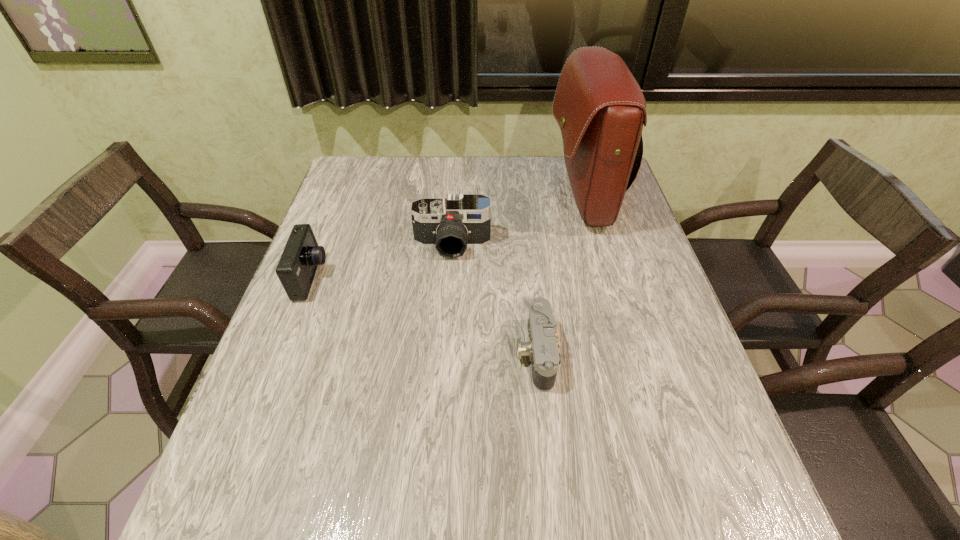
Where is `free space located on the front-facing side of the leftmost object`? free space located on the front-facing side of the leftmost object is located at coordinates (371, 278).

This screenshot has height=540, width=960. Identify the location of free space located on the lens of the nearest object. (465, 353).

I want to click on vacant space located on the lens of the nearest object, so (x=370, y=353).

Image resolution: width=960 pixels, height=540 pixels. I want to click on vacant space located 0.080m on the lens of the nearest object, so click(479, 353).

What are the coordinates of `object located in the far edge section of the desktop` in the screenshot? It's located at (599, 106).

The width and height of the screenshot is (960, 540). I want to click on object that is at the left edge, so point(296,269).

Locate an element on the screen. The height and width of the screenshot is (540, 960). object present at the right edge is located at coordinates (599, 106).

Image resolution: width=960 pixels, height=540 pixels. In order to click on object at the far right corner in this screenshot , I will do `click(599, 106)`.

Where is `free spot at the far edge of the desktop`? free spot at the far edge of the desktop is located at coordinates (492, 178).

In the image, there is a desktop. Identify the location of vacant space at the near edge. This screenshot has width=960, height=540. (323, 497).